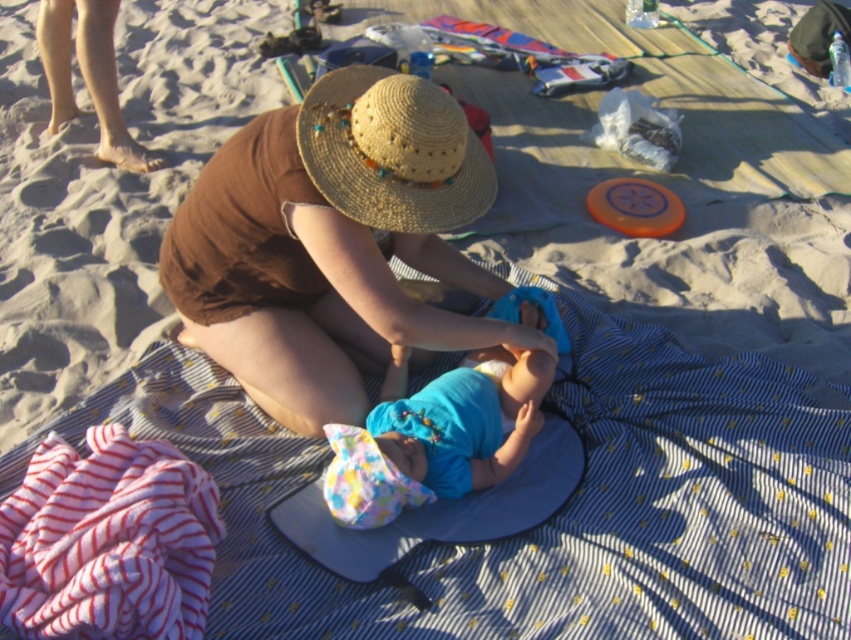
You are a photographer setting up for a beach photo shoot. You have a striped cotton towel at lower left and a straw hat at center in your frame. Which object is shorter in height?

The striped cotton towel at lower left is not as tall as the straw hat at center, so the striped cotton towel at lower left is shorter in height.

You are a photographer trying to capture a closeup shot of the brown straw hat at center and the striped cotton towel at lower left. Your camera has a maximum focus range of 20 inches. Can you take a photo that includes both objects without moving the camera?

The brown straw hat at center is 23.29 inches away from the striped cotton towel at lower left. Since the distance between them exceeds the camera maximum focus range of 20 inches, you cannot take a photo that includes both objects without moving the camera.

You are a photographer trying to capture the perfect shot of the brown straw hat at center. The hat is located at coordinates point 0.380, 0.391. If you adjust your camera to focus on this point, will the hat be centered in your photo? Explain why or why not.

The brown straw hat at center is already positioned at the specified coordinates, so focusing the camera on point (332, 243) will center the hat in the photo.